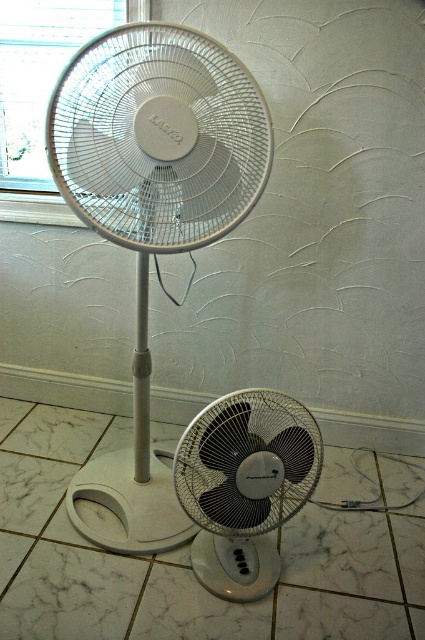
You are setting up a fan display in a store. You have a white plastic mechanical fan at upper center and a black plastic fan at lower center. Which fan should you place on the higher shelf to match their sizes?

The white plastic mechanical fan at upper center is bigger than the black plastic fan at lower center, so you should place the white plastic mechanical fan at upper center on the higher shelf to accommodate its larger size.